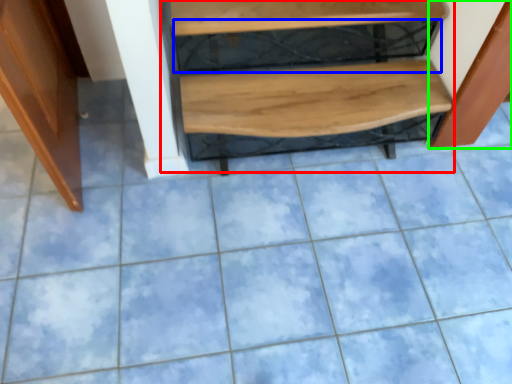
Question: Which object is positioned farthest from stairwell (highlighted by a red box)? Select from shelf (highlighted by a blue box) and cabinetry (highlighted by a green box).

Choices:
 (A) shelf
 (B) cabinetry

Answer: (B)